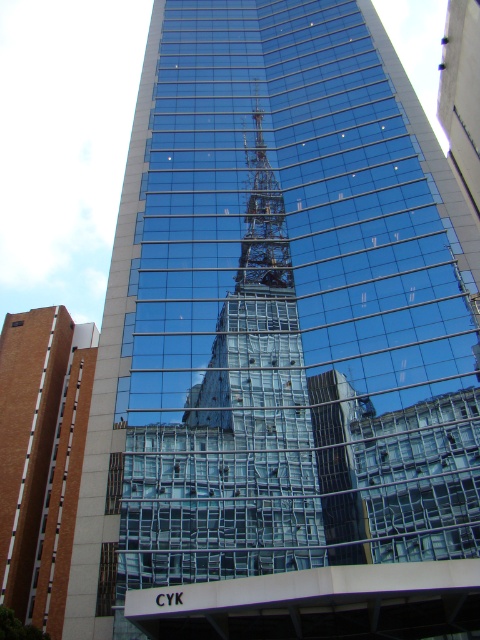
You are an architect analyzing the modern high rise building. You notice the brown brick building at lower left and the metallic lattice structure at center. Which of these two objects is bigger in size?

The brown brick building at lower left has a larger size compared to the metallic lattice structure at center, so the brown brick building at lower left is bigger in size.

You are an architect analyzing the modern high rise building. You notice the brown brick building at lower left and the metallic lattice structure at center. Which of these two objects is taller?

The brown brick building at lower left is much taller than the metallic lattice structure at center.